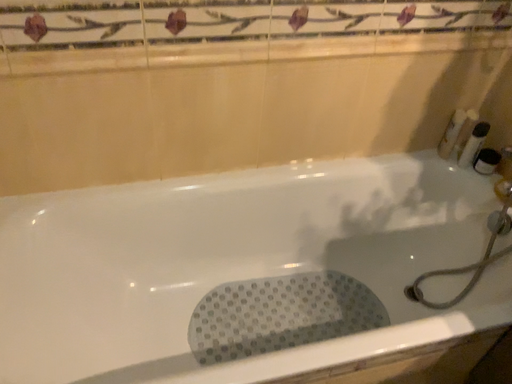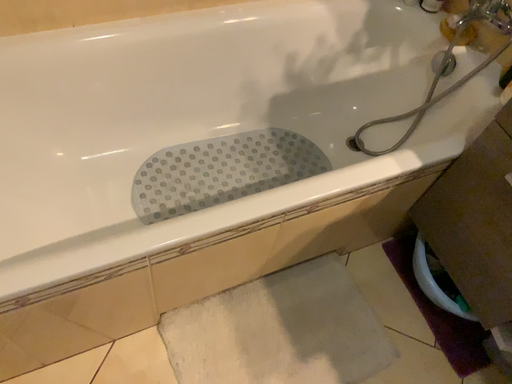
Question: How did the camera likely rotate when shooting the video?

Choices:
 (A) rotated right
 (B) rotated left

Answer: (A)